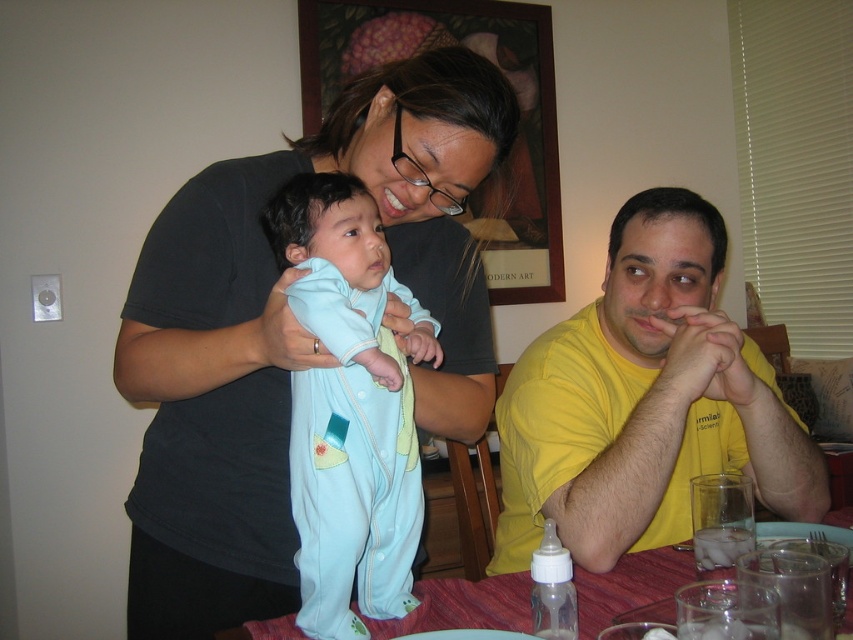
Question: Based on their relative distances, which object is nearer to the red tablecloth at lower center?

Choices:
 (A) matte black shirt at upper left
 (B) yellow cotton shirt at right
 (C) light blue fabric onesie at center

Answer: (B)

Question: Which point is farther to the camera?

Choices:
 (A) matte black shirt at upper left
 (B) yellow cotton shirt at right
 (C) light blue fabric onesie at center
 (D) red tablecloth at lower center

Answer: (B)

Question: Which point is farther to the camera?

Choices:
 (A) light blue fabric onesie at center
 (B) red tablecloth at lower center

Answer: (B)

Question: Can you confirm if light blue fabric onesie at center is thinner than red tablecloth at lower center?

Choices:
 (A) no
 (B) yes

Answer: (B)

Question: Can you confirm if matte black shirt at upper left is positioned to the right of red tablecloth at lower center?

Choices:
 (A) yes
 (B) no

Answer: (B)

Question: Does yellow cotton shirt at right appear on the left side of red tablecloth at lower center?

Choices:
 (A) yes
 (B) no

Answer: (B)